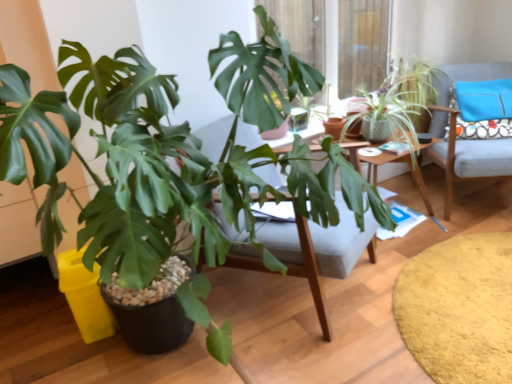
Question: Is wooden swivel chair at center smaller than green matte plant at center, which is counted as the first houseplant, starting from the front?

Choices:
 (A) no
 (B) yes

Answer: (B)

Question: Is wooden swivel chair at center positioned behind green matte plant at center, positioned as the 2th houseplant in right-to-left order?

Choices:
 (A) yes
 (B) no

Answer: (A)

Question: Can you confirm if wooden swivel chair at center is taller than green matte plant at center, the first houseplant viewed from the left?

Choices:
 (A) yes
 (B) no

Answer: (B)

Question: Considering the relative positions of wooden swivel chair at center and green matte plant at center, positioned as the 2th houseplant in right-to-left order, in the image provided, is wooden swivel chair at center to the left of green matte plant at center, positioned as the 2th houseplant in right-to-left order, from the viewer's perspective?

Choices:
 (A) yes
 (B) no

Answer: (B)

Question: From the image's perspective, is wooden swivel chair at center below green matte plant at center, positioned as the 2th houseplant in right-to-left order?

Choices:
 (A) yes
 (B) no

Answer: (B)

Question: In the image, is green matte plant at center, positioned as the 2th houseplant in right-to-left order, positioned in front of or behind wooden desk at center?

Choices:
 (A) front
 (B) behind

Answer: (A)

Question: Visually, is green matte plant at center, which is counted as the first houseplant, starting from the front, positioned to the left or to the right of wooden desk at center?

Choices:
 (A) left
 (B) right

Answer: (A)

Question: Is green matte plant at center, positioned as the 2th houseplant in right-to-left order, situated inside wooden desk at center or outside?

Choices:
 (A) outside
 (B) inside

Answer: (A)

Question: Is point (105, 117) closer or farther from the camera than point (356, 157)?

Choices:
 (A) farther
 (B) closer

Answer: (B)

Question: Visually, is blue fabric pillow at upper right positioned to the left or to the right of soft yellow rug at lower right?

Choices:
 (A) left
 (B) right

Answer: (B)

Question: Is blue fabric pillow at upper right taller or shorter than soft yellow rug at lower right?

Choices:
 (A) short
 (B) tall

Answer: (B)

Question: Considering the positions of point (474, 115) and point (507, 317), is point (474, 115) closer or farther from the camera than point (507, 317)?

Choices:
 (A) closer
 (B) farther

Answer: (B)

Question: Do you think blue fabric pillow at upper right is within soft yellow rug at lower right, or outside of it?

Choices:
 (A) inside
 (B) outside

Answer: (B)

Question: Considering the relative positions of green matte plant at center, which is counted as the first houseplant, starting from the front, and light gray fabric chair at right in the image provided, is green matte plant at center, which is counted as the first houseplant, starting from the front, to the left or to the right of light gray fabric chair at right?

Choices:
 (A) left
 (B) right

Answer: (A)

Question: Is green matte plant at center, which is counted as the first houseplant, starting from the front, taller or shorter than light gray fabric chair at right?

Choices:
 (A) tall
 (B) short

Answer: (A)